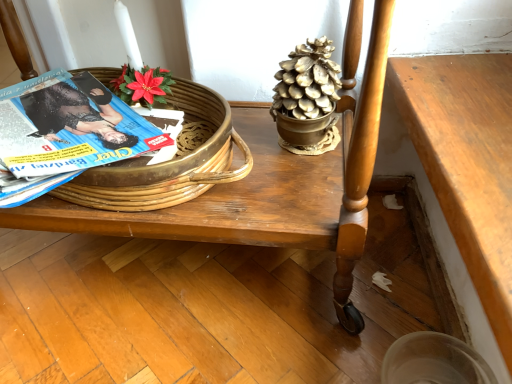
Question: Is gold metallic pinecone at upper center positioned before woven wood basket at upper left?

Choices:
 (A) no
 (B) yes

Answer: (A)

Question: Is gold metallic pinecone at upper center wider than woven wood basket at upper left?

Choices:
 (A) no
 (B) yes

Answer: (A)

Question: From the image's perspective, is gold metallic pinecone at upper center located above woven wood basket at upper left?

Choices:
 (A) yes
 (B) no

Answer: (A)

Question: Is gold metallic pinecone at upper center shorter than woven wood basket at upper left?

Choices:
 (A) yes
 (B) no

Answer: (B)

Question: Is gold metallic pinecone at upper center oriented towards woven wood basket at upper left?

Choices:
 (A) yes
 (B) no

Answer: (B)

Question: Considering the relative positions of wooden table at lower right and blue glossy magazine at left in the image provided, is wooden table at lower right to the left or to the right of blue glossy magazine at left?

Choices:
 (A) left
 (B) right

Answer: (B)

Question: In terms of size, does wooden table at lower right appear bigger or smaller than blue glossy magazine at left?

Choices:
 (A) big
 (B) small

Answer: (A)

Question: Is wooden table at lower right wider or thinner than blue glossy magazine at left?

Choices:
 (A) thin
 (B) wide

Answer: (A)

Question: From the image's perspective, relative to blue glossy magazine at left, is wooden table at lower right above or below?

Choices:
 (A) below
 (B) above

Answer: (A)

Question: Considering the positions of wooden table at center and blue glossy magazine at left in the image, is wooden table at center wider or thinner than blue glossy magazine at left?

Choices:
 (A) wide
 (B) thin

Answer: (A)

Question: Looking at the image, does wooden table at center seem bigger or smaller compared to blue glossy magazine at left?

Choices:
 (A) big
 (B) small

Answer: (A)

Question: From a real-world perspective, relative to blue glossy magazine at left, is wooden table at center vertically above or below?

Choices:
 (A) below
 (B) above

Answer: (A)

Question: Considering the relative positions of wooden table at center and blue glossy magazine at left in the image provided, is wooden table at center to the left or to the right of blue glossy magazine at left?

Choices:
 (A) right
 (B) left

Answer: (A)

Question: Looking at their shapes, would you say wooden table at center is wider or thinner than woven wood basket at upper left?

Choices:
 (A) wide
 (B) thin

Answer: (A)

Question: Considering the relative positions of wooden table at center and woven wood basket at upper left in the image provided, is wooden table at center to the left or to the right of woven wood basket at upper left?

Choices:
 (A) right
 (B) left

Answer: (A)